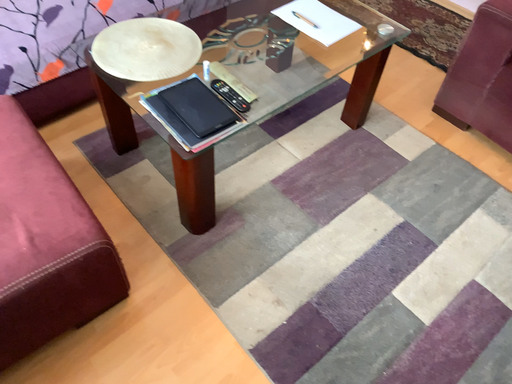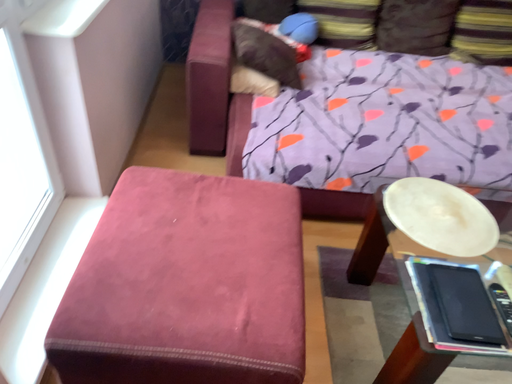
Question: Which way did the camera rotate in the video?

Choices:
 (A) rotated downward
 (B) rotated upward

Answer: (B)